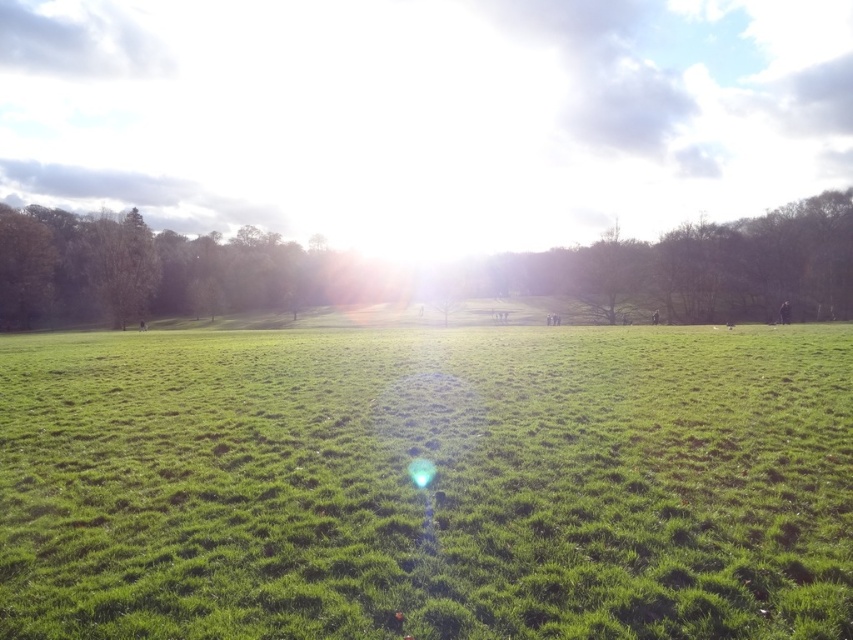
Question: Which object is farther from the camera taking this photo?

Choices:
 (A) green leafy tree at center
 (B) green leafy tree at left

Answer: (B)

Question: Can you confirm if green grass at center is positioned above green leafy tree at center?

Choices:
 (A) yes
 (B) no

Answer: (B)

Question: Is green leafy tree at left positioned before green leafy tree at center?

Choices:
 (A) no
 (B) yes

Answer: (A)

Question: Among these objects, which one is nearest to the camera?

Choices:
 (A) green leafy tree at left
 (B) green leafy tree at center

Answer: (B)

Question: Among these points, which one is nearest to the camera?

Choices:
 (A) (641, 259)
 (B) (833, 384)

Answer: (B)

Question: Is green leafy tree at left thinner than green leafy tree at center?

Choices:
 (A) yes
 (B) no

Answer: (B)